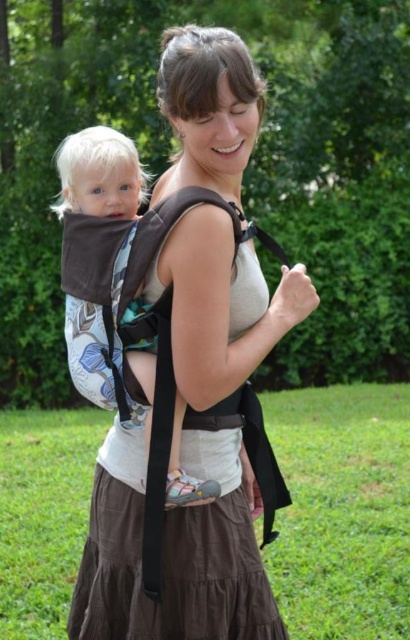
Question: Can you confirm if brown fabric carrier at center is thinner than black fabric strap at upper center?

Choices:
 (A) yes
 (B) no

Answer: (B)

Question: Does brown fabric carrier at center appear on the left side of black fabric strap at upper center?

Choices:
 (A) no
 (B) yes

Answer: (B)

Question: Does brown fabric carrier at center have a larger size compared to black fabric strap at upper center?

Choices:
 (A) yes
 (B) no

Answer: (A)